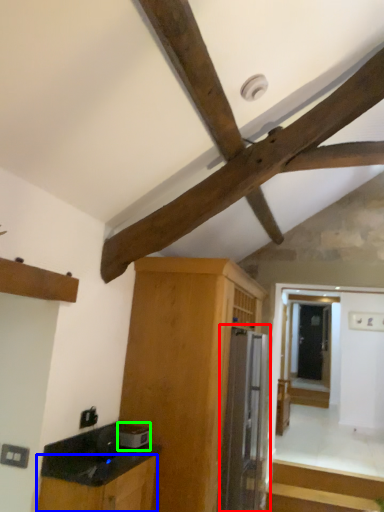
Question: Considering the real-world distances, which object is closest to appliance (highlighted by a red box)? cabinetry (highlighted by a blue box) or appliance (highlighted by a green box).

Choices:
 (A) cabinetry
 (B) appliance

Answer: (B)